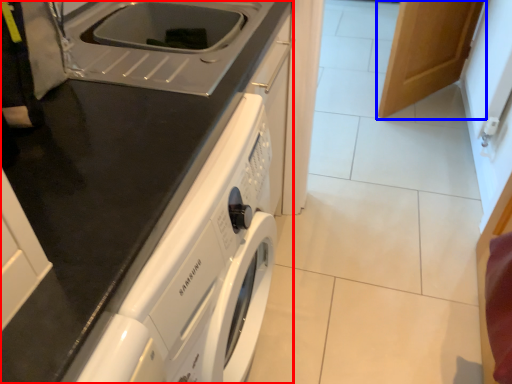
Question: Which point is further to the camera, home appliance (highlighted by a red box) or cabinetry (highlighted by a blue box)?

Choices:
 (A) home appliance
 (B) cabinetry

Answer: (B)